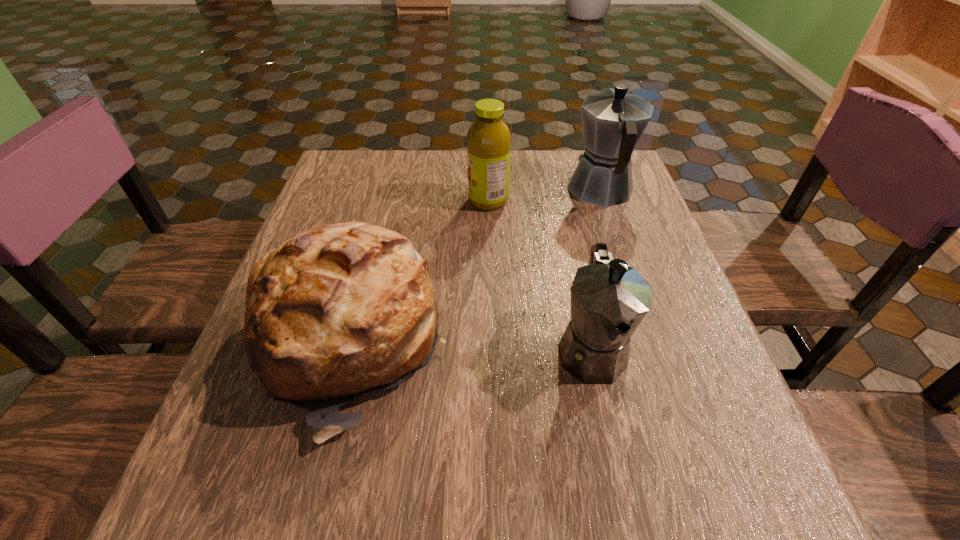
I want to click on empty space between the leftmost object and the farther coffeepot, so click(475, 267).

Identify the location of empty location between the nearer coffeepot and the bread. The width and height of the screenshot is (960, 540). 470,346.

This screenshot has width=960, height=540. I want to click on free spot between the taller coffeepot and the fruit juice, so click(x=544, y=195).

Where is `free space between the nearer coffeepot and the fruit juice`? Image resolution: width=960 pixels, height=540 pixels. free space between the nearer coffeepot and the fruit juice is located at coordinates (540, 275).

The image size is (960, 540). Find the location of `free space between the nearer coffeepot and the third object from right to left`. free space between the nearer coffeepot and the third object from right to left is located at coordinates (540, 275).

Image resolution: width=960 pixels, height=540 pixels. I want to click on free space between the nearer coffeepot and the third object from right to left, so click(540, 275).

Identify the location of object that is the closest to the taller coffeepot. The height and width of the screenshot is (540, 960). (489, 138).

Locate an element on the screen. The height and width of the screenshot is (540, 960). the second closest object relative to the third object from right to left is located at coordinates (340, 310).